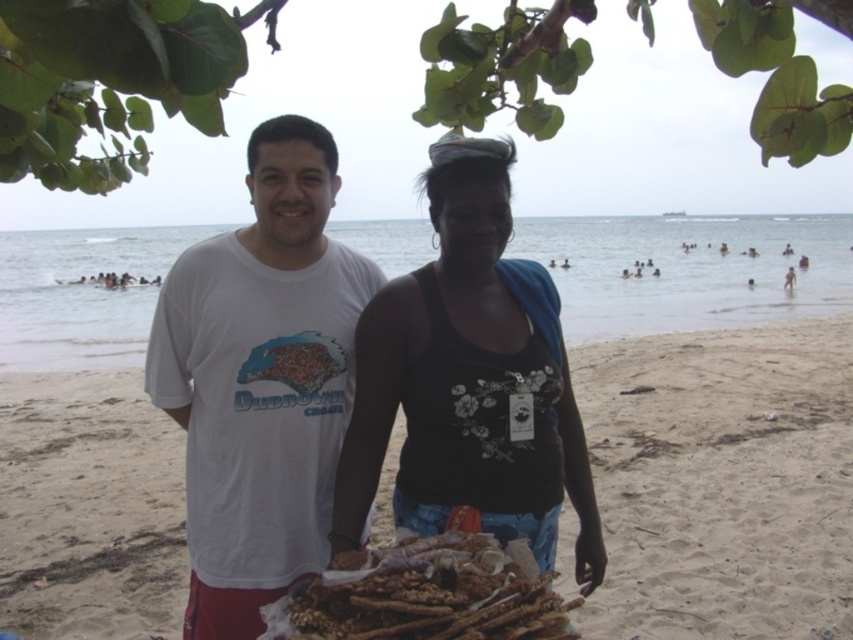
From the picture: What are the coordinates of the brown sandy beach at center?

The brown sandy beach at center is located at coordinates point (722,481).

Looking at this image, you are standing at the origin of a coordinate system placed at the bottom left corner of the beach image. You want to walk to the point labeled point (407, 588) first and then to point (94, 499). Will you have to walk past the first point to reach the second?

Yes, because point (94, 499) is behind point (407, 588), so you will have to walk past the first point to reach the second.

You are standing at the point marked by the coordinates point (201,467) on the beach. You want to walk directly towards the ocean. How far will you have to walk to reach the ocean from your current position?

The distance between point (201,467) and the ocean is 2.65 meters, so you will have to walk 2.65 meters to reach the ocean from your current position.